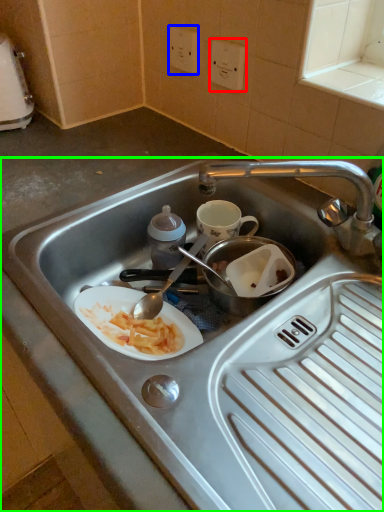
Question: Estimate the real-world distances between objects in this image. Which object is closer to electric outlet (highlighted by a red box), electric outlet (highlighted by a blue box) or sink (highlighted by a green box)?

Choices:
 (A) electric outlet
 (B) sink

Answer: (A)